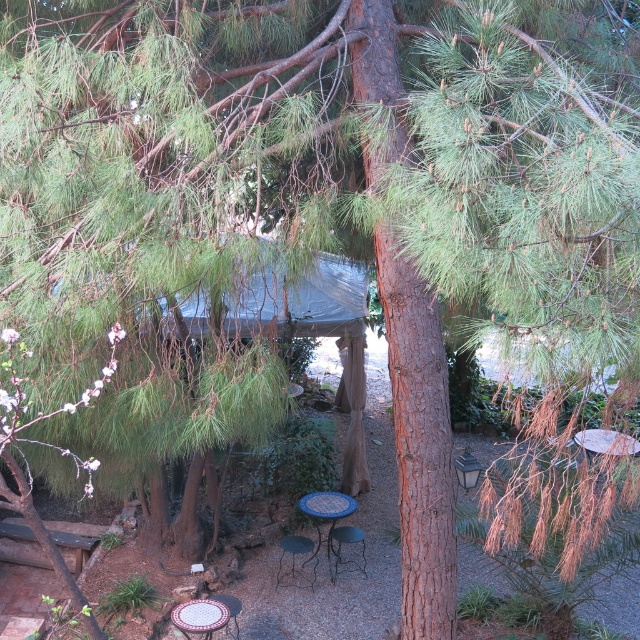
Question: Which object is the closest to the mosaic tile chair at lower center?

Choices:
 (A) mosaic tile picnic table at lower center
 (B) metallic mesh chair at center
 (C) metallic dark blue chair at center
 (D) blue mosaic table at center

Answer: (A)

Question: Based on their relative distances, which object is farther from the metallic dark blue chair at center?

Choices:
 (A) mosaic tile chair at lower center
 (B) metallic mesh chair at center

Answer: (A)

Question: Can you confirm if mosaic tile picnic table at lower center is wider than metallic mesh chair at center?

Choices:
 (A) no
 (B) yes

Answer: (B)

Question: Is metallic dark blue chair at center positioned in front of blue mosaic table at center?

Choices:
 (A) no
 (B) yes

Answer: (A)

Question: Can you confirm if mosaic tile picnic table at lower center is thinner than metallic mesh chair at center?

Choices:
 (A) yes
 (B) no

Answer: (B)

Question: Which of the following is the closest to the observer?

Choices:
 (A) (237, 609)
 (B) (339, 570)
 (C) (209, 602)
 (D) (307, 541)

Answer: (C)